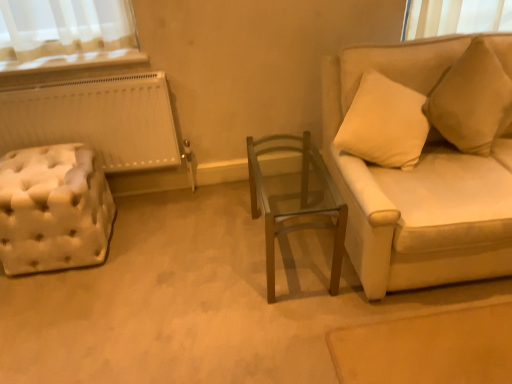
Question: From a real-world perspective, is wooden glass table at center over beige fabric couch at right?

Choices:
 (A) yes
 (B) no

Answer: (B)

Question: Does wooden glass table at center appear on the right side of beige fabric couch at right?

Choices:
 (A) yes
 (B) no

Answer: (B)

Question: Considering the relative sizes of wooden glass table at center and beige fabric couch at right in the image provided, is wooden glass table at center wider than beige fabric couch at right?

Choices:
 (A) no
 (B) yes

Answer: (A)

Question: Is wooden glass table at center at the left side of beige fabric couch at right?

Choices:
 (A) no
 (B) yes

Answer: (B)

Question: Would you say wooden glass table at center is outside beige fabric couch at right?

Choices:
 (A) yes
 (B) no

Answer: (A)

Question: Is white tufted ottoman at left in front of or behind beige fabric pillow at upper right in the image?

Choices:
 (A) behind
 (B) front

Answer: (A)

Question: From the image's perspective, is white tufted ottoman at left positioned above or below beige fabric pillow at upper right?

Choices:
 (A) above
 (B) below

Answer: (B)

Question: Considering the positions of white tufted ottoman at left and beige fabric pillow at upper right in the image, is white tufted ottoman at left taller or shorter than beige fabric pillow at upper right?

Choices:
 (A) tall
 (B) short

Answer: (B)

Question: Is white tufted ottoman at left situated inside beige fabric pillow at upper right or outside?

Choices:
 (A) inside
 (B) outside

Answer: (B)

Question: From a real-world perspective, is white tufted ottoman at left above or below wooden glass table at center?

Choices:
 (A) above
 (B) below

Answer: (B)

Question: From the image's perspective, is white tufted ottoman at left positioned above or below wooden glass table at center?

Choices:
 (A) below
 (B) above

Answer: (B)

Question: Considering the positions of point (103, 243) and point (334, 254), is point (103, 243) closer or farther from the camera than point (334, 254)?

Choices:
 (A) farther
 (B) closer

Answer: (A)

Question: Choose the correct answer: Is white tufted ottoman at left inside wooden glass table at center or outside it?

Choices:
 (A) outside
 (B) inside

Answer: (A)

Question: Based on their sizes in the image, would you say wooden glass table at center is bigger or smaller than white tufted ottoman at left?

Choices:
 (A) big
 (B) small

Answer: (A)

Question: Considering the positions of point (339, 268) and point (5, 253), is point (339, 268) closer or farther from the camera than point (5, 253)?

Choices:
 (A) farther
 (B) closer

Answer: (B)